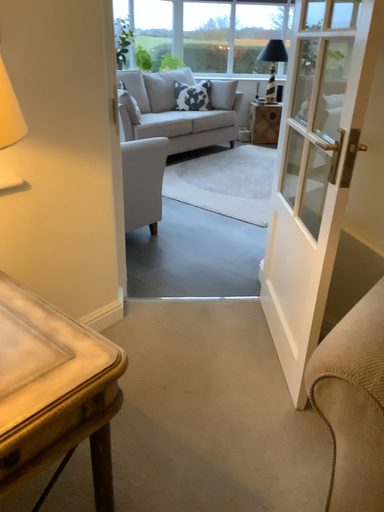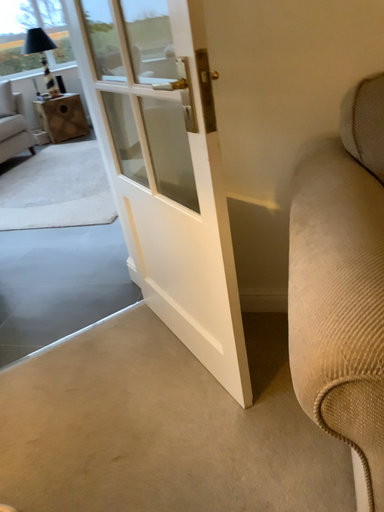
Question: Which way did the camera rotate in the video?

Choices:
 (A) rotated right
 (B) rotated left

Answer: (A)